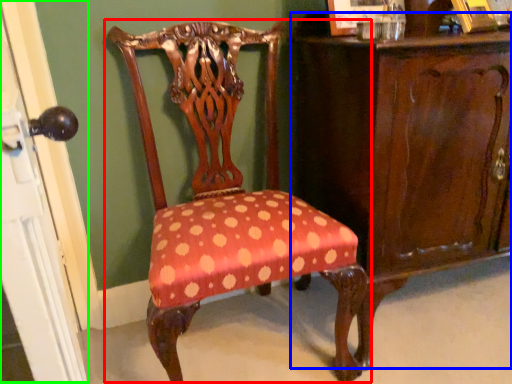
Question: Which is nearer to the chair (highlighted by a red box)? vanity (highlighted by a blue box) or screen door (highlighted by a green box).

Choices:
 (A) vanity
 (B) screen door

Answer: (A)